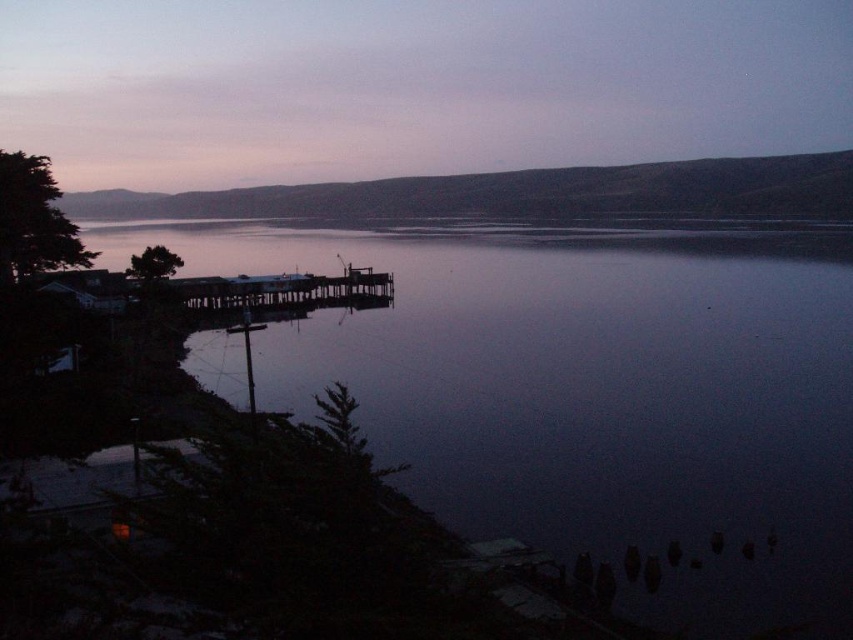
Looking at this image, you are standing on the lakeside and looking at the dark reflective water at center and the purple matte sky at upper center. Which object is closer to you?

The dark reflective water at center is closer to you because it is in front of the purple matte sky at upper center.

You are standing at the lakeside and want to take a photo of the two points. Which point, point (303, 339) or point (329, 288), will appear larger in your camera view?

Point (303, 339) is closer to the camera than point (329, 288), so it will appear larger in the photo.